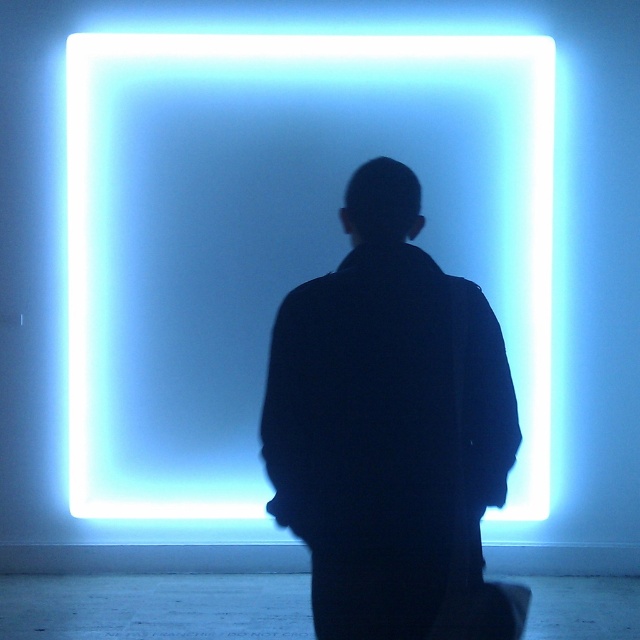
You are a photographer adjusting your camera settings to capture the scene. You notice two points of interest in the image labeled as point [460,227] and point [493,422]. Which point is closer to your camera lens?

Point [460,227] is further to the camera than point [493,422], so the point closer to the camera lens is point [493,422].